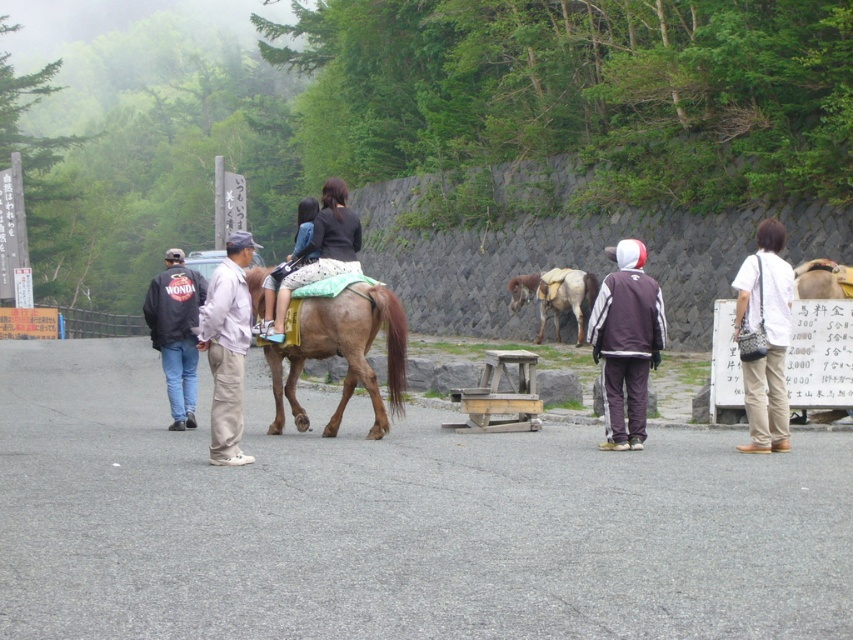
You are standing at the picnic table near the center of the park scene. You notice two points marked in the image. Which point, point 1 at coordinates (769, 276) or point 2 at (552, 272), is closer to you?

Point 1 at coordinates (769, 276) is closer to you because it is closer to the camera than point 2 at (552, 272).

You are planning to cross the path between the two horses. Which direction should you walk to go from the brown horse at center to the brown glossy horse at center?

To go from the brown horse at center to the brown glossy horse at center, you should walk to the right since the brown glossy horse at center is to the right of the brown horse at center.

You are planning to set up a small tent between the brown horse at center and the brown glossy horse at center. The tent requires at least 10 feet of space. Based on the scene, is there enough space between them to set up the tent?

The brown horse at center is 9.17 feet from the brown glossy horse at center. Since the required space is 10 feet, there is not enough space to set up the tent between them.